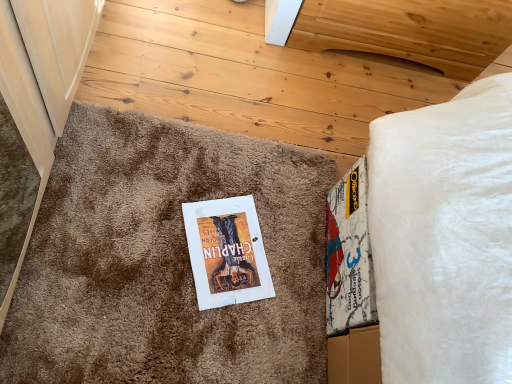
At what (x,y) coordinates should I click in order to perform the action: click on free space above white paper book at center (from a real-world perspective). Please return your answer as a coordinate pair (x, y). This screenshot has width=512, height=384. Looking at the image, I should click on (223, 243).